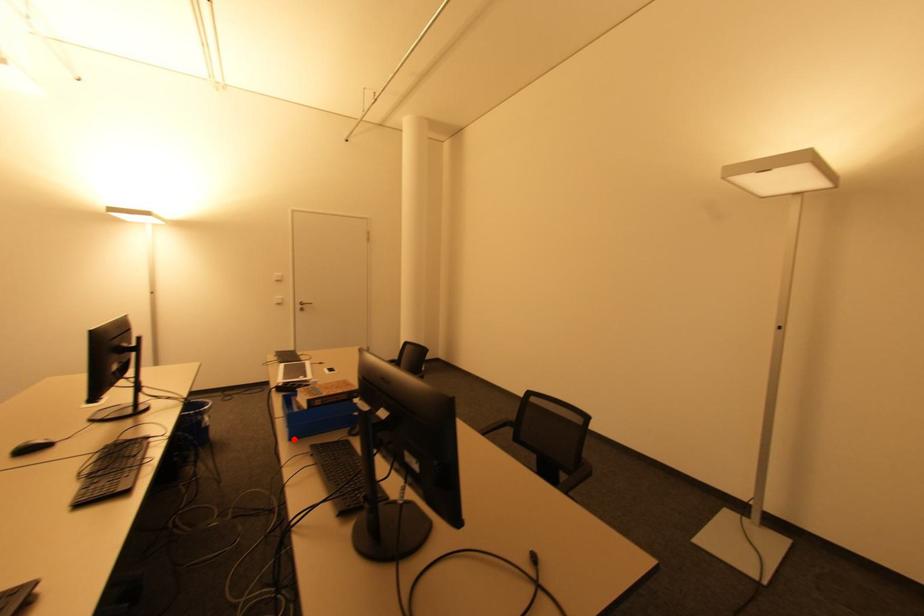
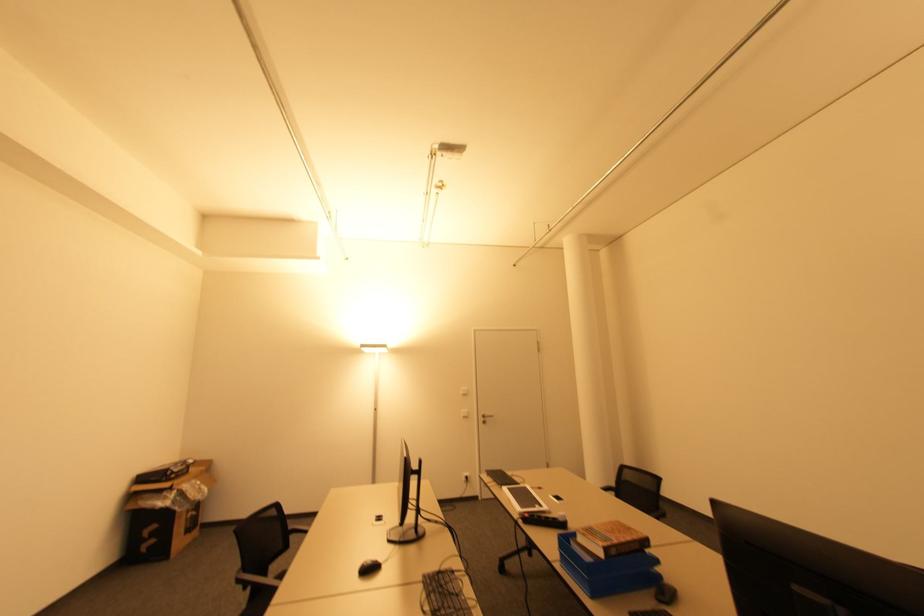
Question: I am providing you with two images of the same scene from different viewpoints. Given a red point in image1, look at the same physical point in image2. Is it:

Choices:
 (A) Closer to the viewpoint
 (B) Farther from the viewpoint

Answer: (A)